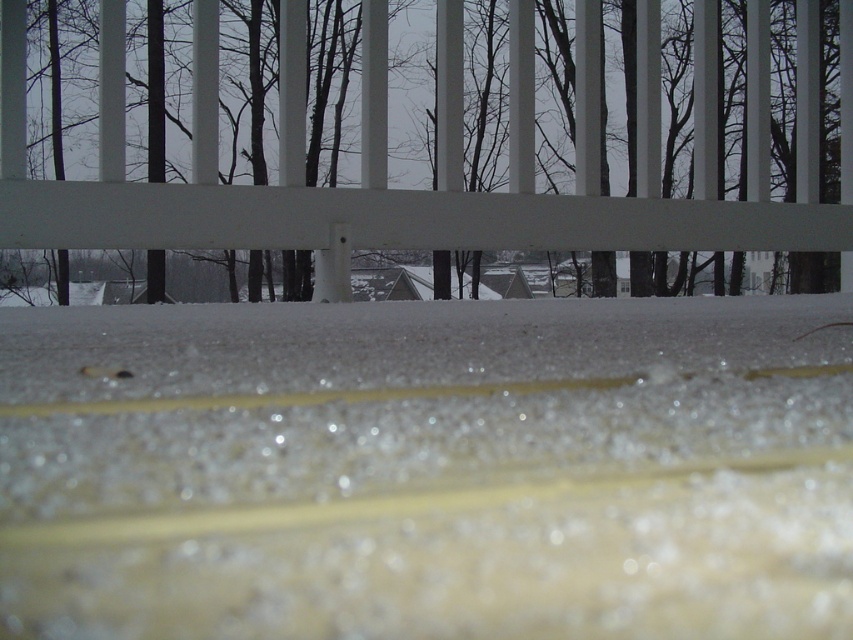
Is translucent ice crystals at center to the left of brown wood tree at upper center from the viewer's perspective?

Yes, translucent ice crystals at center is to the left of brown wood tree at upper center.

Who is more distant from viewer, (22, 499) or (515, 24)?

Positioned behind is point (515, 24).

Locate an element on the screen. translucent ice crystals at center is located at coordinates (428, 468).

What are the coordinates of `translucent ice crystals at center` in the screenshot? It's located at (428, 468).